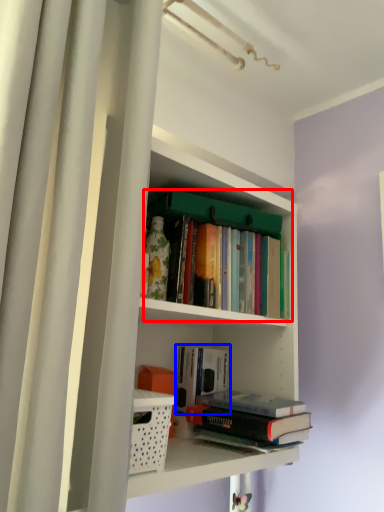
Question: Which of the following is the farthest to the observer, book (highlighted by a red box) or book (highlighted by a blue box)?

Choices:
 (A) book
 (B) book

Answer: (B)